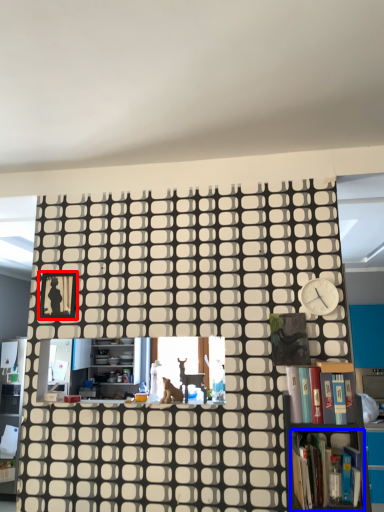
Question: Which object is closer to the camera taking this photo, picture frame (highlighted by a red box) or book (highlighted by a blue box)?

Choices:
 (A) picture frame
 (B) book

Answer: (B)